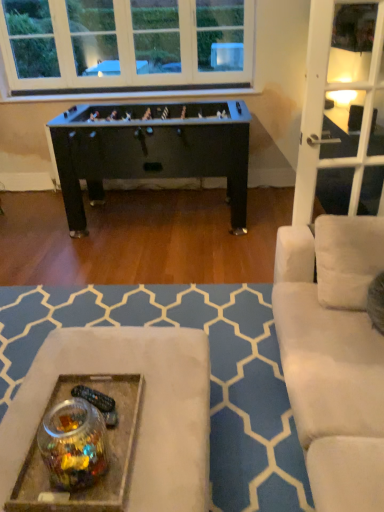
The width and height of the screenshot is (384, 512). What do you see at coordinates (73, 444) in the screenshot? I see `translucent glass jar at lower left` at bounding box center [73, 444].

Where is `translucent glass jar at lower left`? The width and height of the screenshot is (384, 512). translucent glass jar at lower left is located at coordinates (73, 444).

What is the approximate width of translucent glass jar at lower left?

translucent glass jar at lower left is 8.75 inches in width.

This screenshot has height=512, width=384. What do you see at coordinates (140, 412) in the screenshot?
I see `metallic tray at lower center` at bounding box center [140, 412].

Identify the location of metallic tray at lower center. This screenshot has width=384, height=512. (140, 412).

At what (x,y) coordinates should I click in order to perform the action: click on translucent glass jar at lower left. Please return your answer as a coordinate pair (x, y). This screenshot has height=512, width=384. Looking at the image, I should click on (73, 444).

Is translucent glass jar at lower left to the right of metallic tray at lower center from the viewer's perspective?

Yes, translucent glass jar at lower left is to the right of metallic tray at lower center.

Which object is closer to the camera, translucent glass jar at lower left or metallic tray at lower center?

translucent glass jar at lower left is more forward.

Considering the points (96, 420) and (171, 332), which point is behind, point (96, 420) or point (171, 332)?

The point (171, 332) is farther from the camera.

From the image's perspective, which one is positioned higher, translucent glass jar at lower left or metallic tray at lower center?

translucent glass jar at lower left, from the image's perspective.

Looking at this image, from a real-world perspective, who is located lower, translucent glass jar at lower left or metallic tray at lower center?

From a 3D spatial view, metallic tray at lower center is below.

Based on the photo, which of these two, translucent glass jar at lower left or metallic tray at lower center, is thinner?

Thinner between the two is translucent glass jar at lower left.

Considering the sizes of objects translucent glass jar at lower left and metallic tray at lower center in the image provided, who is taller, translucent glass jar at lower left or metallic tray at lower center?

With more height is translucent glass jar at lower left.

Considering the sizes of objects translucent glass jar at lower left and metallic tray at lower center in the image provided, who is bigger, translucent glass jar at lower left or metallic tray at lower center?

Bigger between the two is translucent glass jar at lower left.

Would you say translucent glass jar at lower left is inside or outside metallic tray at lower center?

translucent glass jar at lower left is located beyond the bounds of metallic tray at lower center.

Is translucent glass jar at lower left far away from metallic tray at lower center?

Actually, translucent glass jar at lower left and metallic tray at lower center are a little close together.

In the scene shown: Is translucent glass jar at lower left facing towards metallic tray at lower center?

No.

Can you tell me how much translucent glass jar at lower left and metallic tray at lower center differ in facing direction?

They differ by 0.000107 degrees in their facing directions.

The width and height of the screenshot is (384, 512). Identify the location of glass jar in front of the metallic tray at lower center. 73,444.

Based on the photo, visually, is metallic tray at lower center positioned to the left or to the right of translucent glass jar at lower left?

From the image, it's evident that metallic tray at lower center is to the left of translucent glass jar at lower left.

Looking at this image, who is more distant, metallic tray at lower center or translucent glass jar at lower left?

metallic tray at lower center.

Is point (162, 344) closer or farther from the camera than point (66, 482)?

Point (162, 344) appears to be farther away from the viewer than point (66, 482).

From the image's perspective, which is below, metallic tray at lower center or translucent glass jar at lower left?

metallic tray at lower center, from the image's perspective.

From a real-world perspective, does metallic tray at lower center stand above translucent glass jar at lower left?

Actually, metallic tray at lower center is physically below translucent glass jar at lower left in the real world.

Which of these two, metallic tray at lower center or translucent glass jar at lower left, is thinner?

With smaller width is translucent glass jar at lower left.

Who is taller, metallic tray at lower center or translucent glass jar at lower left?

Standing taller between the two is translucent glass jar at lower left.

Looking at this image, between metallic tray at lower center and translucent glass jar at lower left, which one has larger size?

translucent glass jar at lower left.

Does metallic tray at lower center contain translucent glass jar at lower left?

Definitely not — translucent glass jar at lower left is not inside metallic tray at lower center.

Are metallic tray at lower center and translucent glass jar at lower left making contact?

No, metallic tray at lower center is not with translucent glass jar at lower left.

Is metallic tray at lower center looking in the opposite direction of translucent glass jar at lower left?

That's not correct — metallic tray at lower center is not looking away from translucent glass jar at lower left.

Can you tell me how much metallic tray at lower center and translucent glass jar at lower left differ in facing direction?

metallic tray at lower center and translucent glass jar at lower left are facing 0.000107 degrees away from each other.

Measure the distance from metallic tray at lower center to translucent glass jar at lower left.

metallic tray at lower center and translucent glass jar at lower left are 8.91 inches apart.

Image resolution: width=384 pixels, height=512 pixels. I want to click on glass jar in front of the metallic tray at lower center, so click(73, 444).

Locate an element on the screen. The image size is (384, 512). table below the translucent glass jar at lower left (from the image's perspective) is located at coordinates (140, 412).

This screenshot has width=384, height=512. In order to click on glass jar in front of the metallic tray at lower center in this screenshot , I will do `click(73, 444)`.